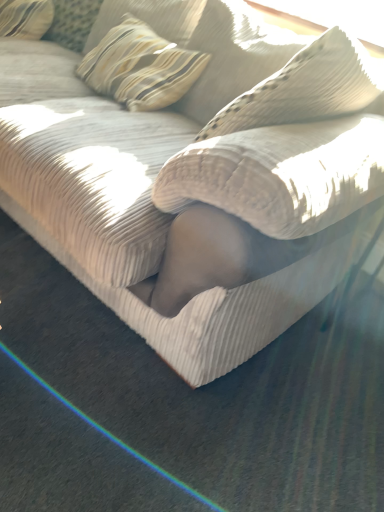
Question: Should I look upward or downward to see striped fabric pillow at upper left?

Choices:
 (A) down
 (B) up

Answer: (B)